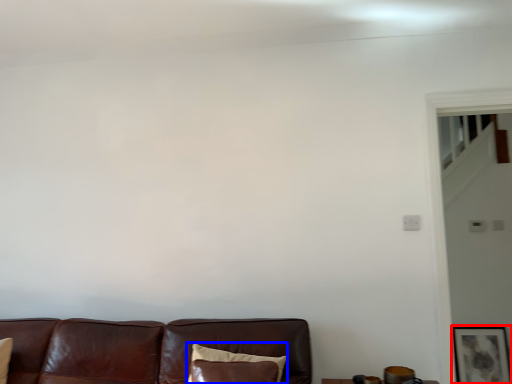
Question: Among these objects, which one is nearest to the camera, picture frame (highlighted by a red box) or pillow (highlighted by a blue box)?

Choices:
 (A) picture frame
 (B) pillow

Answer: (B)